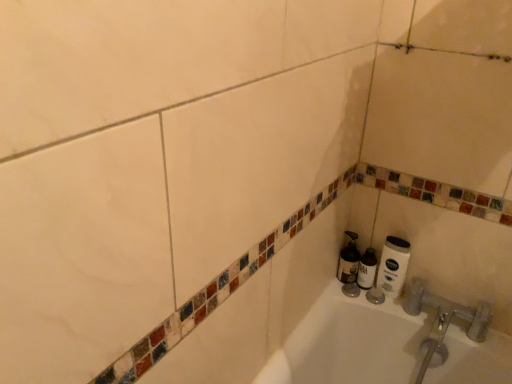
What do you see at coordinates (367, 269) in the screenshot?
I see `white matte shaving cream at lower right, placed as the first shaving cream when sorted from right to left` at bounding box center [367, 269].

Identify the location of white matte shaving cream at lower right, which appears as the first shaving cream when viewed from the left. (349, 260).

The width and height of the screenshot is (512, 384). Describe the element at coordinates (349, 260) in the screenshot. I see `white matte shaving cream at lower right, which appears as the first shaving cream when viewed from the left` at that location.

I want to click on white matte shaving cream at lower right, which is the 2th shaving cream in left-to-right order, so click(367, 269).

Does white matte toilet paper at lower right appear on the right side of white matte shaving cream at lower right, the 2th shaving cream from the right?

Yes, white matte toilet paper at lower right is to the right of white matte shaving cream at lower right, the 2th shaving cream from the right.

Could you tell me if white matte toilet paper at lower right is turned towards white matte shaving cream at lower right, the 2th shaving cream from the right?

No, white matte toilet paper at lower right is not oriented towards white matte shaving cream at lower right, the 2th shaving cream from the right.

From the image's perspective, who appears lower, white matte toilet paper at lower right or white matte shaving cream at lower right, the 2th shaving cream from the right?

white matte toilet paper at lower right is shown below in the image.

From a real-world perspective, relative to white matte shaving cream at lower right, the 2th shaving cream from the right, is white matte toilet paper at lower right vertically above or below?

Clearly, from a real-world perspective, white matte toilet paper at lower right is above white matte shaving cream at lower right, the 2th shaving cream from the right.

Which object is closer to the camera, white matte toilet paper at lower right or white matte shaving cream at lower right, which is the 2th shaving cream in left-to-right order?

white matte toilet paper at lower right is closer to the camera.

Based on the photo, from the image's perspective, does white matte toilet paper at lower right appear lower than white matte shaving cream at lower right, placed as the first shaving cream when sorted from right to left?

No, from the image's perspective, white matte toilet paper at lower right is not below white matte shaving cream at lower right, placed as the first shaving cream when sorted from right to left.

In the scene shown: Which is less distant, (402,269) or (368,276)?

Point (402,269) is positioned closer to the camera compared to point (368,276).

Is white matte toilet paper at lower right taller or shorter than white matte shaving cream at lower right, which is the 2th shaving cream in left-to-right order?

white matte toilet paper at lower right is taller than white matte shaving cream at lower right, which is the 2th shaving cream in left-to-right order.

Consider the image. Considering the sizes of white matte shaving cream at lower right, which appears as the first shaving cream when viewed from the left, and white matte toilet paper at lower right in the image, is white matte shaving cream at lower right, which appears as the first shaving cream when viewed from the left, bigger or smaller than white matte toilet paper at lower right?

Considering their sizes, white matte shaving cream at lower right, which appears as the first shaving cream when viewed from the left, takes up more space than white matte toilet paper at lower right.

Is white matte shaving cream at lower right, which appears as the first shaving cream when viewed from the left, looking in the opposite direction of white matte toilet paper at lower right?

No, white matte shaving cream at lower right, which appears as the first shaving cream when viewed from the left,'s orientation is not away from white matte toilet paper at lower right.

Considering the sizes of objects white matte shaving cream at lower right, the 2th shaving cream from the right, and white matte toilet paper at lower right in the image provided, who is wider, white matte shaving cream at lower right, the 2th shaving cream from the right, or white matte toilet paper at lower right?

Wider between the two is white matte shaving cream at lower right, the 2th shaving cream from the right.

How many degrees apart are the facing directions of white matte shaving cream at lower right, which is the 2th shaving cream in left-to-right order, and white matte toilet paper at lower right?

0.00654 degrees separate the facing orientations of white matte shaving cream at lower right, which is the 2th shaving cream in left-to-right order, and white matte toilet paper at lower right.

Does white matte shaving cream at lower right, placed as the first shaving cream when sorted from right to left, have a larger size compared to white matte toilet paper at lower right?

No, white matte shaving cream at lower right, placed as the first shaving cream when sorted from right to left, is not bigger than white matte toilet paper at lower right.

From the image's perspective, which is above, white matte shaving cream at lower right, which is the 2th shaving cream in left-to-right order, or white matte toilet paper at lower right?

From the image's view, white matte toilet paper at lower right is above.

Does white matte shaving cream at lower right, which is the 2th shaving cream in left-to-right order, have a lesser width compared to white matte toilet paper at lower right?

Incorrect, the width of white matte shaving cream at lower right, which is the 2th shaving cream in left-to-right order, is not less than that of white matte toilet paper at lower right.

From a real-world perspective, which is physically below, white matte shaving cream at lower right, which appears as the first shaving cream when viewed from the left, or white matte shaving cream at lower right, which is the 2th shaving cream in left-to-right order?

white matte shaving cream at lower right, which is the 2th shaving cream in left-to-right order, is physically lower.

Does white matte shaving cream at lower right, which appears as the first shaving cream when viewed from the left, turn towards white matte shaving cream at lower right, placed as the first shaving cream when sorted from right to left?

No, white matte shaving cream at lower right, which appears as the first shaving cream when viewed from the left, is not oriented towards white matte shaving cream at lower right, placed as the first shaving cream when sorted from right to left.

Looking at their sizes, would you say white matte shaving cream at lower right, the 2th shaving cream from the right, is wider or thinner than white matte shaving cream at lower right, which is the 2th shaving cream in left-to-right order?

In the image, white matte shaving cream at lower right, the 2th shaving cream from the right, appears to be wider than white matte shaving cream at lower right, which is the 2th shaving cream in left-to-right order.

Which object is positioned more to the left, white matte shaving cream at lower right, which appears as the first shaving cream when viewed from the left, or white matte shaving cream at lower right, which is the 2th shaving cream in left-to-right order?

white matte shaving cream at lower right, which appears as the first shaving cream when viewed from the left.

Are white matte shaving cream at lower right, which is the 2th shaving cream in left-to-right order, and white matte shaving cream at lower right, the 2th shaving cream from the right, beside each other?

Yes, white matte shaving cream at lower right, which is the 2th shaving cream in left-to-right order, is right next to white matte shaving cream at lower right, the 2th shaving cream from the right, and making contact.

Does white matte shaving cream at lower right, placed as the first shaving cream when sorted from right to left, have a greater height compared to white matte shaving cream at lower right, which appears as the first shaving cream when viewed from the left?

No.

What's the angular difference between white matte shaving cream at lower right, which is the 2th shaving cream in left-to-right order, and white matte shaving cream at lower right, the 2th shaving cream from the right,'s facing directions?

0.00191 degrees separate the facing orientations of white matte shaving cream at lower right, which is the 2th shaving cream in left-to-right order, and white matte shaving cream at lower right, the 2th shaving cream from the right.

Would you say white matte shaving cream at lower right, placed as the first shaving cream when sorted from right to left, is to the left or to the right of white matte shaving cream at lower right, which appears as the first shaving cream when viewed from the left, in the picture?

Clearly, white matte shaving cream at lower right, placed as the first shaving cream when sorted from right to left, is on the right of white matte shaving cream at lower right, which appears as the first shaving cream when viewed from the left, in the image.

I want to click on toilet paper below the white matte shaving cream at lower right, the 2th shaving cream from the right (from the image's perspective), so pos(393,266).

This screenshot has height=384, width=512. Identify the location of toilet paper in front of the white matte shaving cream at lower right, placed as the first shaving cream when sorted from right to left. (393, 266).

From the image, which object appears to be farther from white matte toilet paper at lower right, white matte shaving cream at lower right, the 2th shaving cream from the right, or white matte shaving cream at lower right, placed as the first shaving cream when sorted from right to left?

white matte shaving cream at lower right, the 2th shaving cream from the right.

From the image, which object appears to be nearer to white matte shaving cream at lower right, the 2th shaving cream from the right, white matte toilet paper at lower right or white matte shaving cream at lower right, which is the 2th shaving cream in left-to-right order?

The object closer to white matte shaving cream at lower right, the 2th shaving cream from the right, is white matte shaving cream at lower right, which is the 2th shaving cream in left-to-right order.

From the image, which object appears to be farther from white matte shaving cream at lower right, the 2th shaving cream from the right, white matte shaving cream at lower right, placed as the first shaving cream when sorted from right to left, or white matte toilet paper at lower right?

Based on the image, white matte toilet paper at lower right appears to be further to white matte shaving cream at lower right, the 2th shaving cream from the right.

Considering their positions, is white matte shaving cream at lower right, which is the 2th shaving cream in left-to-right order, positioned further to white matte toilet paper at lower right than white matte shaving cream at lower right, which appears as the first shaving cream when viewed from the left?

Based on the image, white matte shaving cream at lower right, which appears as the first shaving cream when viewed from the left, appears to be further to white matte toilet paper at lower right.

From the picture: Based on their spatial positions, is white matte toilet paper at lower right or white matte shaving cream at lower right, the 2th shaving cream from the right, closer to white matte shaving cream at lower right, which is the 2th shaving cream in left-to-right order?

white matte shaving cream at lower right, the 2th shaving cream from the right, lies closer to white matte shaving cream at lower right, which is the 2th shaving cream in left-to-right order, than the other object.

From the image, which object appears to be nearer to white matte shaving cream at lower right, which is the 2th shaving cream in left-to-right order, white matte shaving cream at lower right, which appears as the first shaving cream when viewed from the left, or white matte toilet paper at lower right?

white matte shaving cream at lower right, which appears as the first shaving cream when viewed from the left, is positioned closer to the anchor white matte shaving cream at lower right, which is the 2th shaving cream in left-to-right order.

Identify the location of shaving cream between white matte shaving cream at lower right, the 2th shaving cream from the right, and white matte toilet paper at lower right, in the horizontal direction. (367, 269).